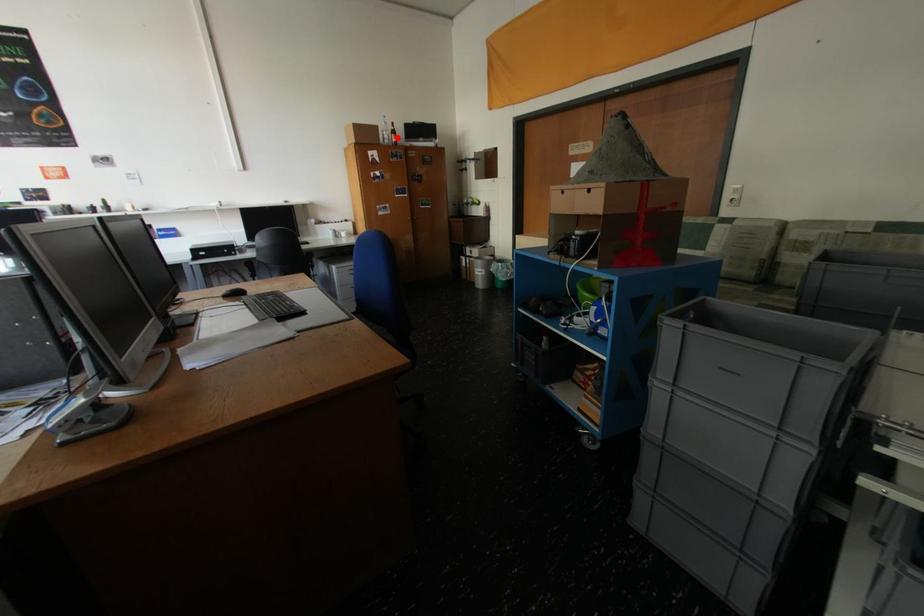
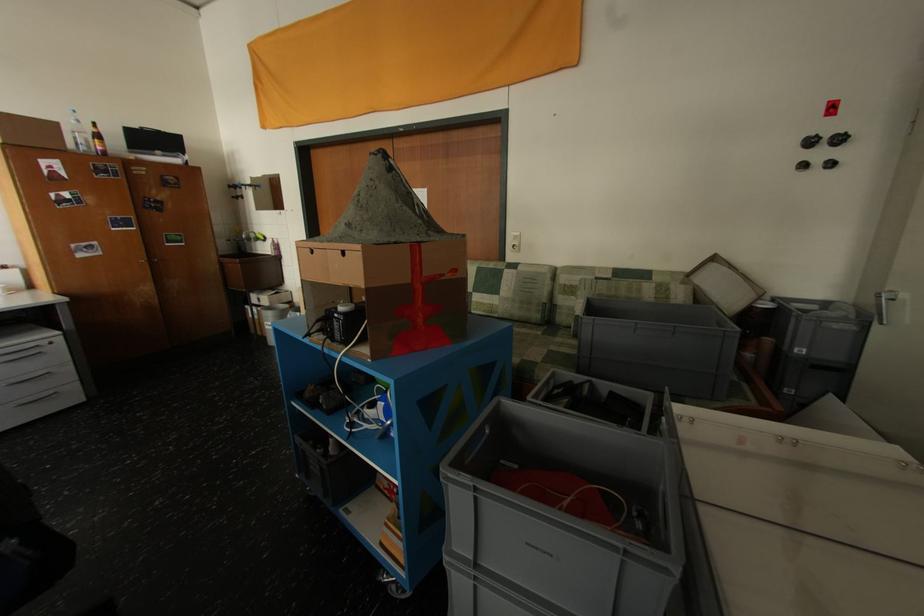
In the second image, find the point that corresponds to the highlighted location in the first image.

(95, 142)